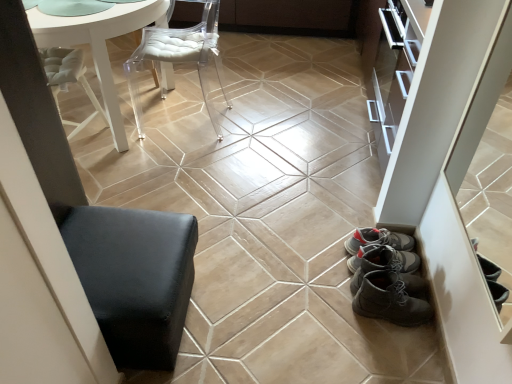
This screenshot has height=384, width=512. What are the coordinates of `free space above beige glossy ceramic tile at center (from a real-world perspective)` in the screenshot? It's located at (269, 269).